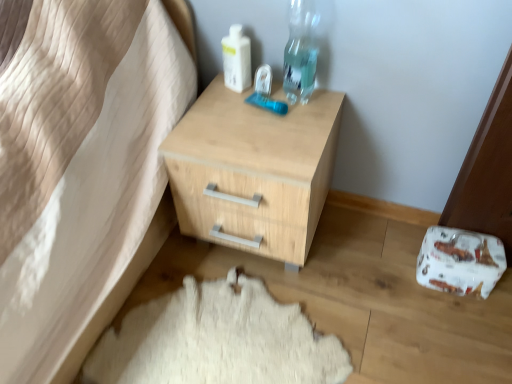
Question: Are transparent plastic bottle at upper right and white plastic bottle at upper center beside each other?

Choices:
 (A) yes
 (B) no

Answer: (B)

Question: From the image's perspective, is transparent plastic bottle at upper right beneath white plastic bottle at upper center?

Choices:
 (A) yes
 (B) no

Answer: (B)

Question: From a real-world perspective, is transparent plastic bottle at upper right under white plastic bottle at upper center?

Choices:
 (A) yes
 (B) no

Answer: (B)

Question: Considering the relative sizes of transparent plastic bottle at upper right and white plastic bottle at upper center in the image provided, is transparent plastic bottle at upper right thinner than white plastic bottle at upper center?

Choices:
 (A) no
 (B) yes

Answer: (A)

Question: From a real-world perspective, is transparent plastic bottle at upper right on white plastic bottle at upper center?

Choices:
 (A) yes
 (B) no

Answer: (A)

Question: In terms of size, does white plastic bottle at upper center appear bigger or smaller than natural wood chest of drawers at center?

Choices:
 (A) small
 (B) big

Answer: (A)

Question: From a real-world perspective, is white plastic bottle at upper center physically located above or below natural wood chest of drawers at center?

Choices:
 (A) below
 (B) above

Answer: (B)

Question: Would you say white plastic bottle at upper center is inside or outside natural wood chest of drawers at center?

Choices:
 (A) inside
 (B) outside

Answer: (B)

Question: Is point (226, 74) closer or farther from the camera than point (197, 117)?

Choices:
 (A) closer
 (B) farther

Answer: (B)

Question: Is transparent plastic bottle at upper right taller or shorter than natural wood chest of drawers at center?

Choices:
 (A) short
 (B) tall

Answer: (A)

Question: In terms of size, does transparent plastic bottle at upper right appear bigger or smaller than natural wood chest of drawers at center?

Choices:
 (A) small
 (B) big

Answer: (A)

Question: Based on their positions, is transparent plastic bottle at upper right located to the left or right of natural wood chest of drawers at center?

Choices:
 (A) right
 (B) left

Answer: (A)

Question: Is transparent plastic bottle at upper right in front of or behind natural wood chest of drawers at center in the image?

Choices:
 (A) behind
 (B) front

Answer: (A)

Question: Relative to white woolen rug at lower center, is transparent plastic bottle at upper right in front or behind?

Choices:
 (A) behind
 (B) front

Answer: (A)

Question: Is point pos(295,84) positioned closer to the camera than point pos(245,350)?

Choices:
 (A) farther
 (B) closer

Answer: (A)